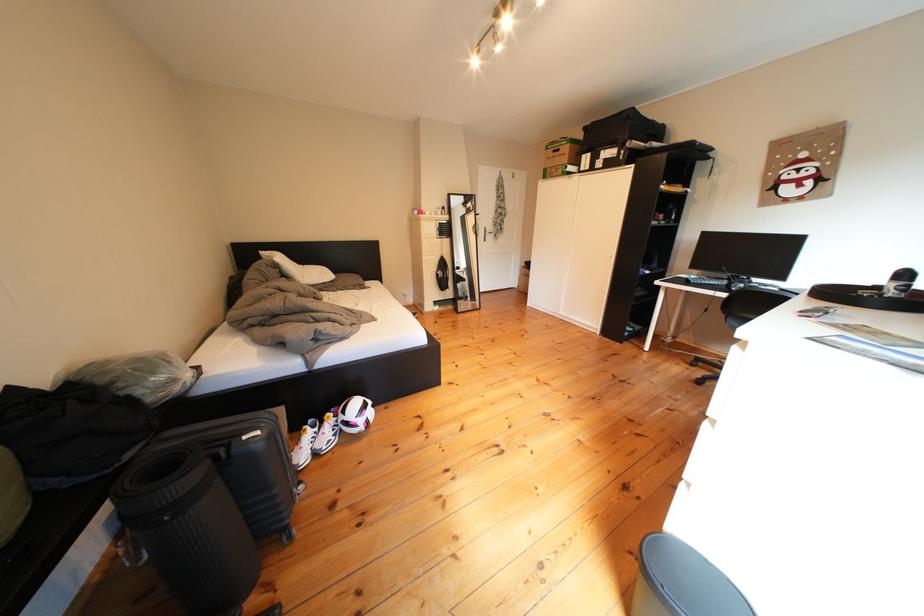
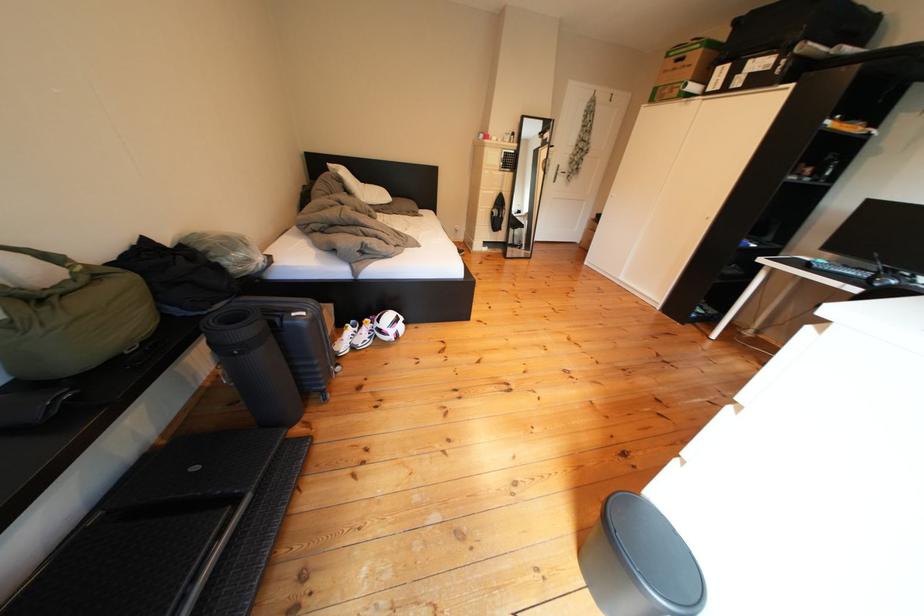
Where in the second image is the point corresponding to [272,437] from the first image?

(317, 318)